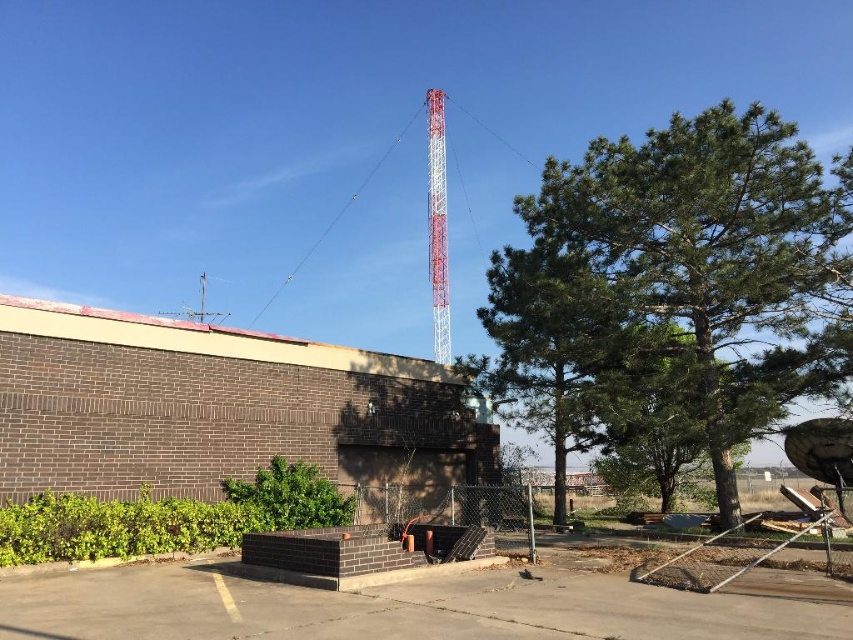
Question: Which is nearer to the green leafy tree at center?

Choices:
 (A) metallic pole at center
 (B) metallic red tower at upper center

Answer: (A)

Question: Which of the following is the farthest from the observer?

Choices:
 (A) (527, 536)
 (B) (436, 248)
 (C) (692, 205)

Answer: (B)

Question: Does metallic red tower at upper center have a smaller size compared to metallic pole at center?

Choices:
 (A) yes
 (B) no

Answer: (B)

Question: Is green leafy tree at center to the right of metallic pole at center from the viewer's perspective?

Choices:
 (A) no
 (B) yes

Answer: (B)

Question: Based on their relative distances, which object is nearer to the metallic pole at center?

Choices:
 (A) metallic red tower at upper center
 (B) green leafy tree at center

Answer: (B)

Question: Does metallic red tower at upper center have a greater width compared to metallic pole at center?

Choices:
 (A) no
 (B) yes

Answer: (B)